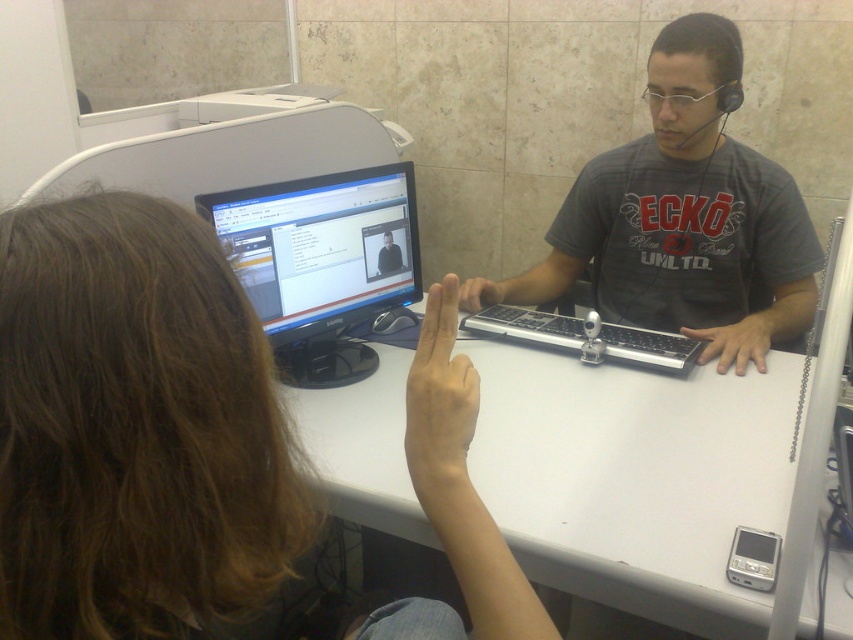
Question: Does matte black monitor at upper center appear under gray matte shirt at center?

Choices:
 (A) yes
 (B) no

Answer: (A)

Question: Does matte black monitor at upper center appear over white plastic table at center?

Choices:
 (A) yes
 (B) no

Answer: (B)

Question: Which object is farther from the camera taking this photo?

Choices:
 (A) matte black monitor at upper center
 (B) gray matte shirt at center
 (C) black glossy monitor at center

Answer: (B)

Question: Is white plastic table at center below black glossy monitor at center?

Choices:
 (A) yes
 (B) no

Answer: (A)

Question: Which point appears closest to the camera in this image?

Choices:
 (A) (599, 214)
 (B) (643, 486)
 (C) (258, 524)

Answer: (C)

Question: Which point appears farthest from the camera in this image?

Choices:
 (A) (653, 237)
 (B) (386, 508)
 (C) (288, 260)
 (D) (154, 372)

Answer: (A)